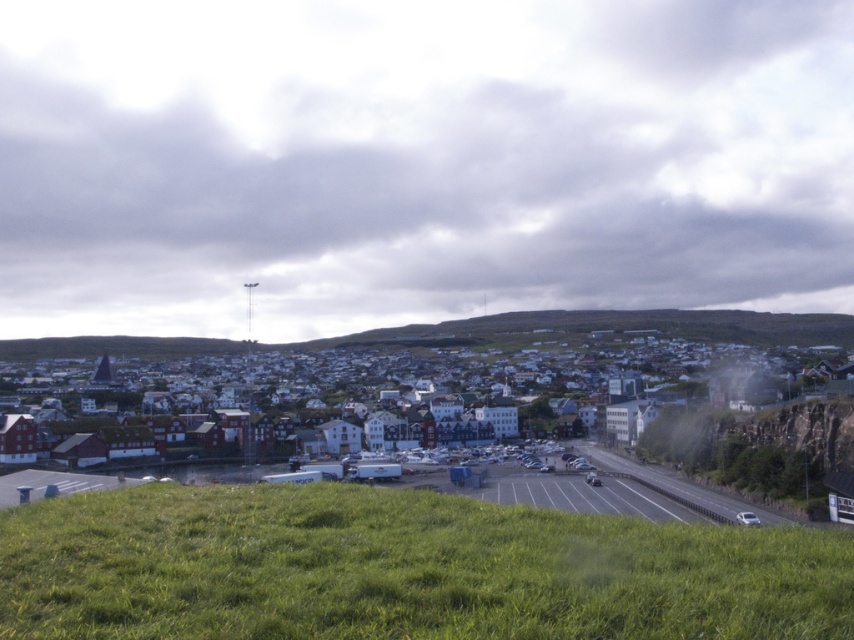
Is green grassy field at lower center thinner than white matte buildings at center?

Yes, green grassy field at lower center is thinner than white matte buildings at center.

Which of these two, green grassy field at lower center or white matte buildings at center, stands shorter?

green grassy field at lower center

Identify the location of green grassy field at lower center. (401, 570).

The width and height of the screenshot is (854, 640). What are the coordinates of `green grassy field at lower center` in the screenshot? It's located at (401, 570).